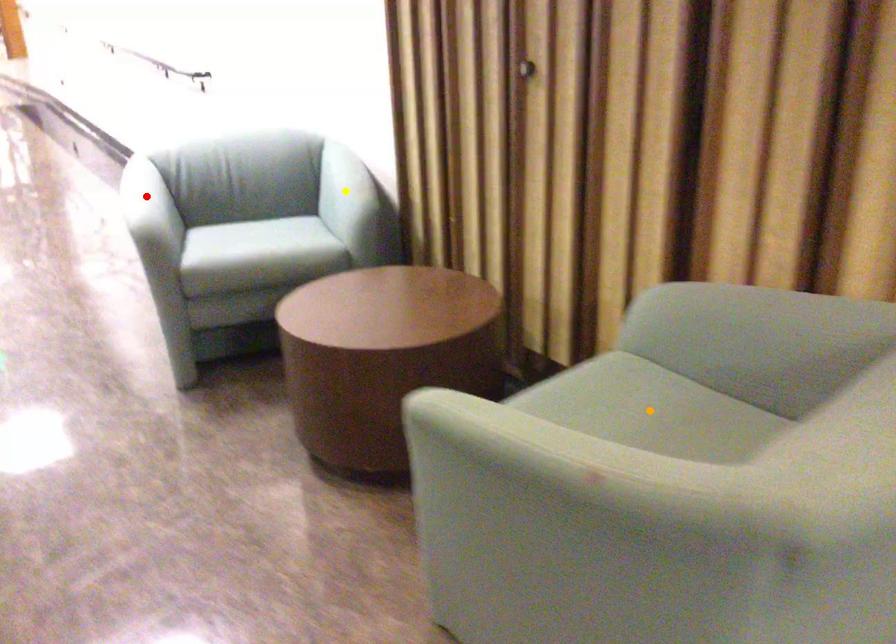
Order these from farthest to nearest:
orange point, yellow point, red point

yellow point
red point
orange point